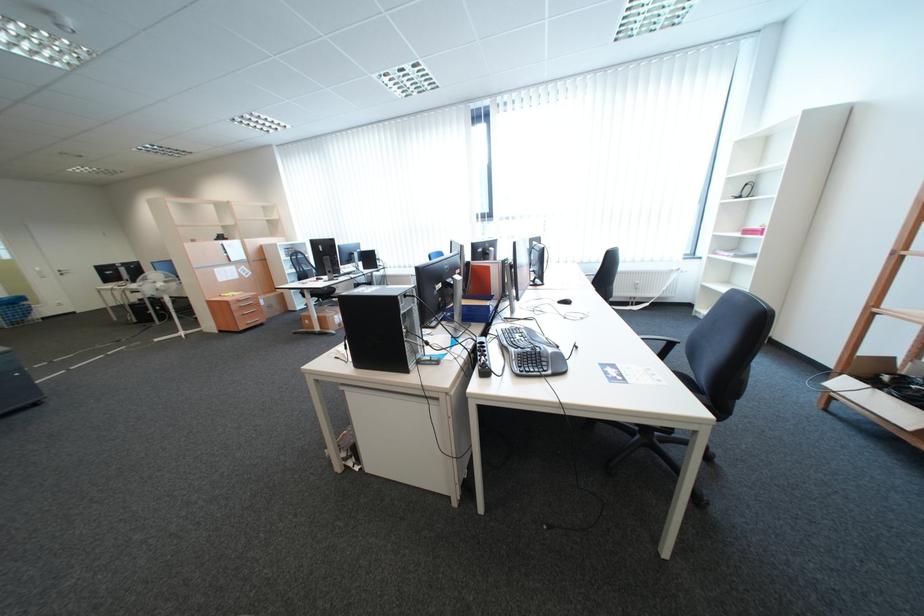
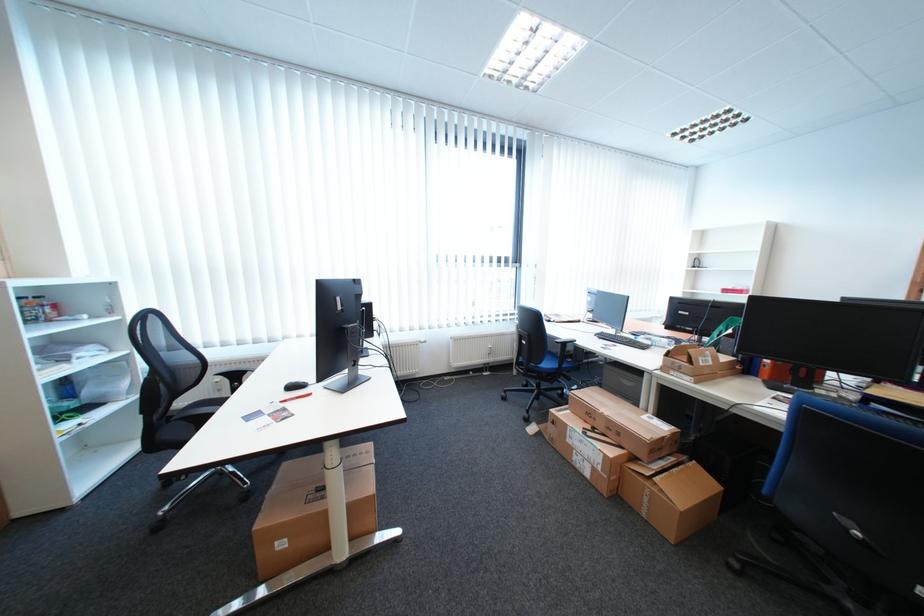
Question: I am providing you with two images of the same scene from different viewpoints. After the viewpoint changes to image2, which objects are now occluded?

Choices:
 (A) black refrigerator handle
 (B) cardboard box
 (C) computer mouse
 (D) red pen

Answer: (C)